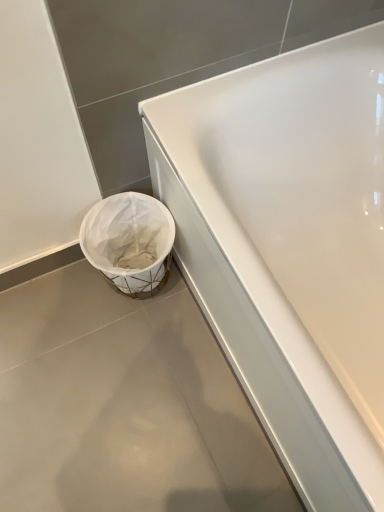
Question: From a real-world perspective, is white matte trash can at lower left positioned under white fabric basket at lower left based on gravity?

Choices:
 (A) no
 (B) yes

Answer: (B)

Question: Are white matte trash can at lower left and white fabric basket at lower left beside each other?

Choices:
 (A) no
 (B) yes

Answer: (A)

Question: Can you confirm if white matte trash can at lower left is wider than white fabric basket at lower left?

Choices:
 (A) yes
 (B) no

Answer: (A)

Question: Is white matte trash can at lower left smaller than white fabric basket at lower left?

Choices:
 (A) yes
 (B) no

Answer: (A)

Question: Can you confirm if white matte trash can at lower left is positioned to the left of white fabric basket at lower left?

Choices:
 (A) yes
 (B) no

Answer: (A)

Question: Is white fabric basket at lower left inside or outside of white matte trash can at lower left?

Choices:
 (A) outside
 (B) inside

Answer: (A)

Question: Is white fabric basket at lower left in front of or behind white matte trash can at lower left in the image?

Choices:
 (A) behind
 (B) front

Answer: (A)

Question: From a real-world perspective, relative to white matte trash can at lower left, is white fabric basket at lower left vertically above or below?

Choices:
 (A) above
 (B) below

Answer: (A)

Question: Considering the relative positions of white fabric basket at lower left and white matte trash can at lower left in the image provided, is white fabric basket at lower left to the left or to the right of white matte trash can at lower left?

Choices:
 (A) left
 (B) right

Answer: (B)

Question: Does point (91, 244) appear closer or farther from the camera than point (253, 109)?

Choices:
 (A) closer
 (B) farther

Answer: (B)

Question: In terms of size, does white fabric basket at lower left appear bigger or smaller than white glossy bathtub at center?

Choices:
 (A) big
 (B) small

Answer: (B)

Question: From a real-world perspective, is white fabric basket at lower left physically located above or below white glossy bathtub at center?

Choices:
 (A) below
 (B) above

Answer: (A)

Question: Considering the positions of white fabric basket at lower left and white glossy bathtub at center in the image, is white fabric basket at lower left wider or thinner than white glossy bathtub at center?

Choices:
 (A) thin
 (B) wide

Answer: (A)

Question: From the image's perspective, relative to white matte trash can at lower left, is white glossy bathtub at center above or below?

Choices:
 (A) above
 (B) below

Answer: (A)

Question: From a real-world perspective, is white glossy bathtub at center physically located above or below white matte trash can at lower left?

Choices:
 (A) above
 (B) below

Answer: (A)